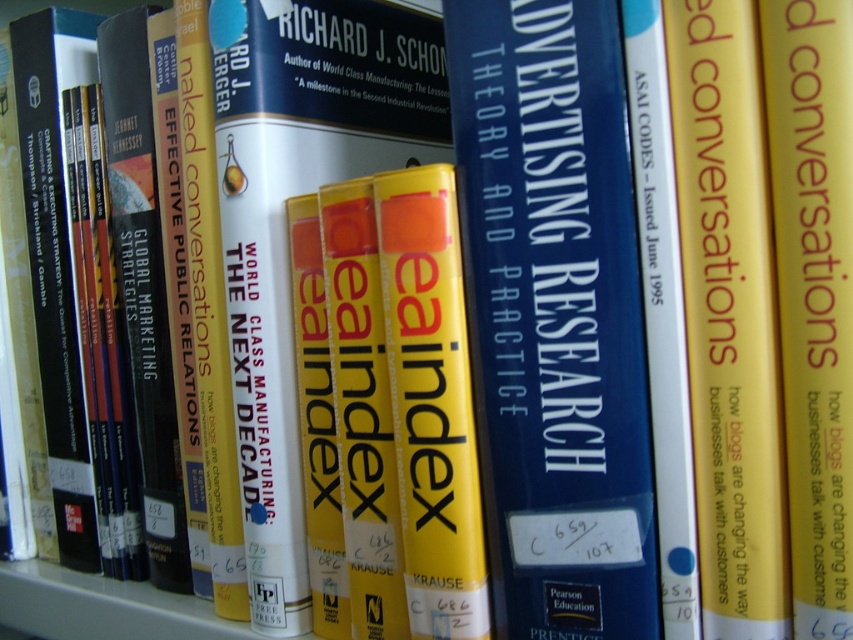
You are standing in front of a bookshelf and see two points marked on the books. The first point is at coordinates point (592, 1) and the second is at point (318, 348). Which point is closer to you?

Point (592, 1) is closer to the viewer than point (318, 348).